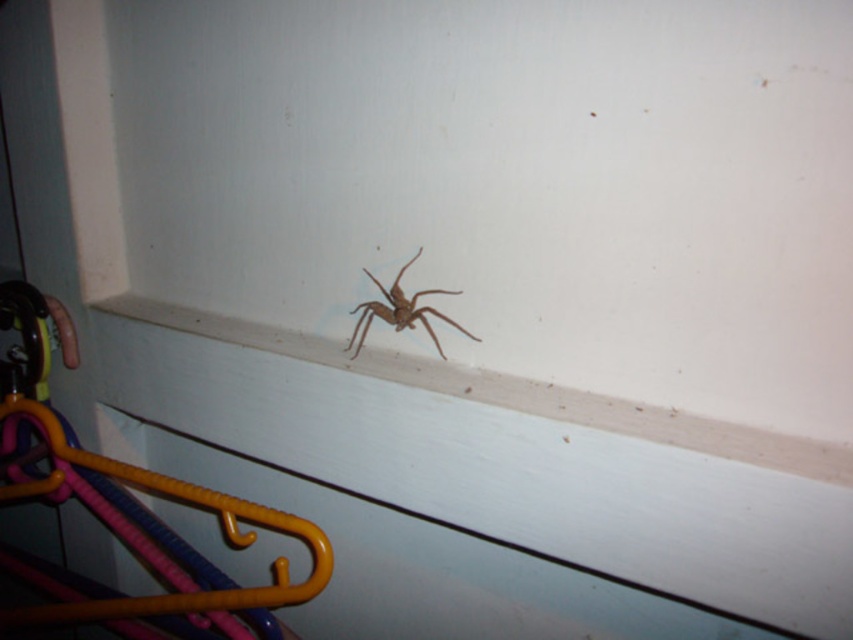
Question: Among these objects, which one is farthest from the camera?

Choices:
 (A) orange plastic hanger at lower left
 (B) brown fuzzy spider at center

Answer: (B)

Question: Considering the relative positions of orange plastic hanger at lower left and brown fuzzy spider at center in the image provided, where is orange plastic hanger at lower left located with respect to brown fuzzy spider at center?

Choices:
 (A) left
 (B) right

Answer: (A)

Question: Which object is the farthest from the orange plastic hanger at lower left?

Choices:
 (A) white smooth window sill at center
 (B) brown fuzzy spider at center

Answer: (B)

Question: Does orange plastic hanger at lower left have a lesser width compared to brown fuzzy spider at center?

Choices:
 (A) yes
 (B) no

Answer: (B)

Question: Among these objects, which one is nearest to the camera?

Choices:
 (A) orange plastic hanger at lower left
 (B) brown fuzzy spider at center

Answer: (A)

Question: Does orange plastic hanger at lower left appear on the left side of white smooth window sill at center?

Choices:
 (A) yes
 (B) no

Answer: (A)